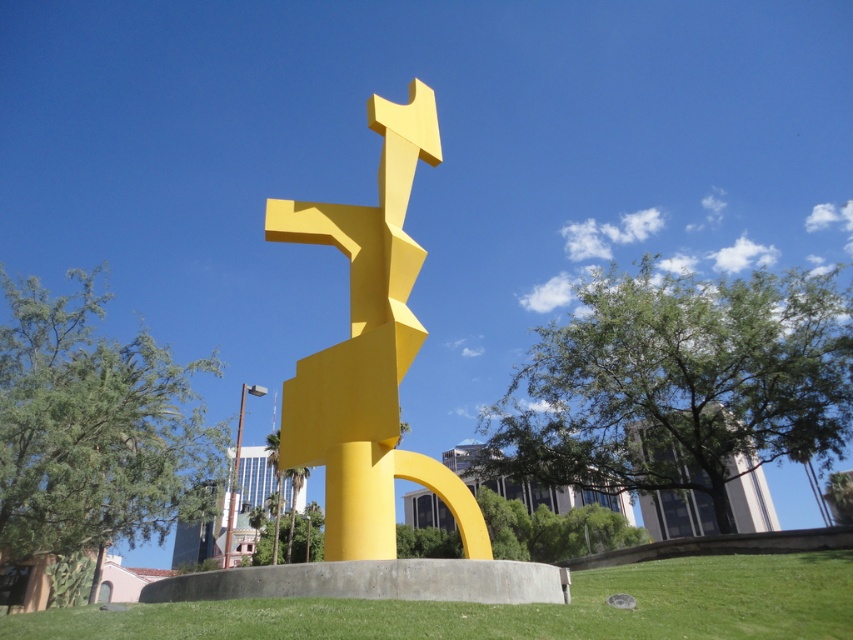
Is point (318, 392) positioned after point (355, 627)?

Yes, point (318, 392) is behind point (355, 627).

Between matte yellow sculpture at center and green grass at center, which one is positioned lower?

green grass at center

The height and width of the screenshot is (640, 853). I want to click on matte yellow sculpture at center, so click(368, 352).

Identify the location of matte yellow sculpture at center. This screenshot has height=640, width=853. (368, 352).